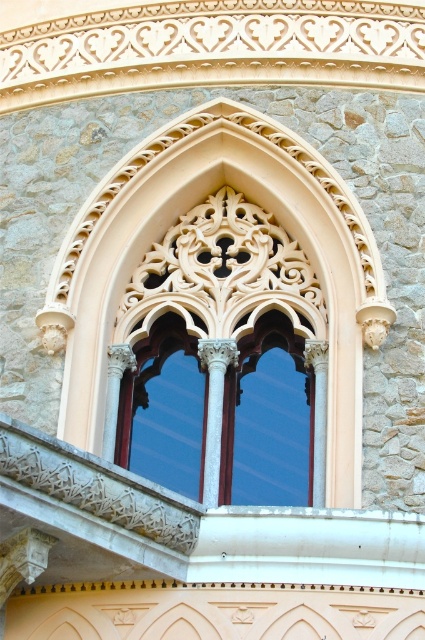
You are an architect designing a new building inspired by Gothic architecture. You have two window options in front of you, the white stone window at center and the matte glass window at center. Which window should you choose if you want a larger window for better natural light?

The white stone window at center has a larger size compared to the matte glass window at center, so it would allow more natural light and is the better choice for the architect.